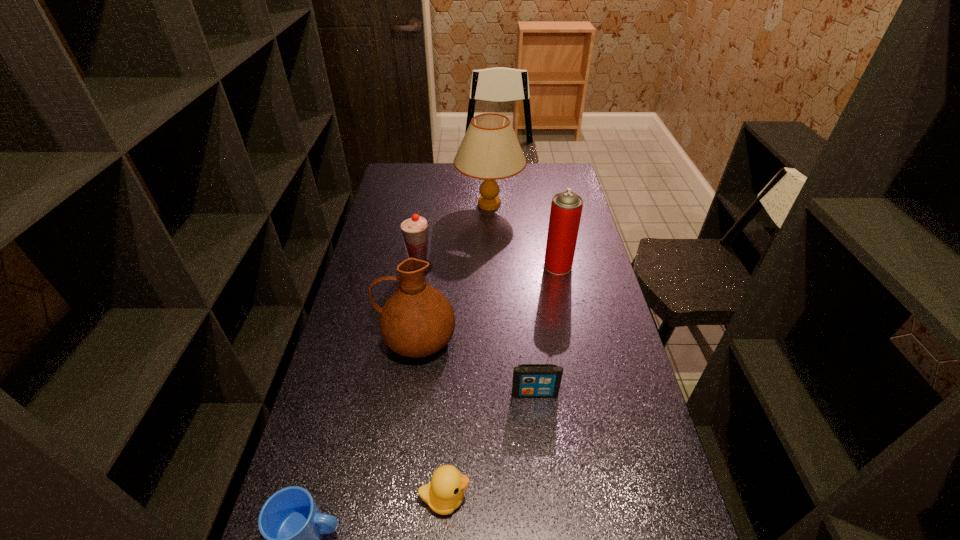
Identify the location of lampshade. This screenshot has height=540, width=960. (490, 151).

This screenshot has height=540, width=960. Find the location of `the rightmost object`. the rightmost object is located at coordinates (566, 207).

Where is `pitcher`? The image size is (960, 540). pitcher is located at coordinates (417, 320).

Locate an element on the screen. The width and height of the screenshot is (960, 540). smoothie is located at coordinates (414, 229).

In order to click on the third nearest object in this screenshot , I will do `click(529, 380)`.

You are a GUI agent. You are given a task and a screenshot of the screen. Output one action in this format:
    pyautogui.click(x=<x>, y=<y>)
    Task: Click on the duck
    This screenshot has height=540, width=960.
    Given the screenshot: What is the action you would take?
    pyautogui.click(x=445, y=493)

I want to click on free space located 0.330m on the front of the lampshade, so click(x=492, y=276).

Image resolution: width=960 pixels, height=540 pixels. Identify the location of free space located 0.170m on the front of the rightmost object. (566, 309).

Image resolution: width=960 pixels, height=540 pixels. I want to click on vacant space located on the side of the fourth nearest object with the handle, so click(x=356, y=338).

The image size is (960, 540). In order to click on blank space located 0.120m on the side of the fourth nearest object with the handle in this screenshot , I will do `click(341, 338)`.